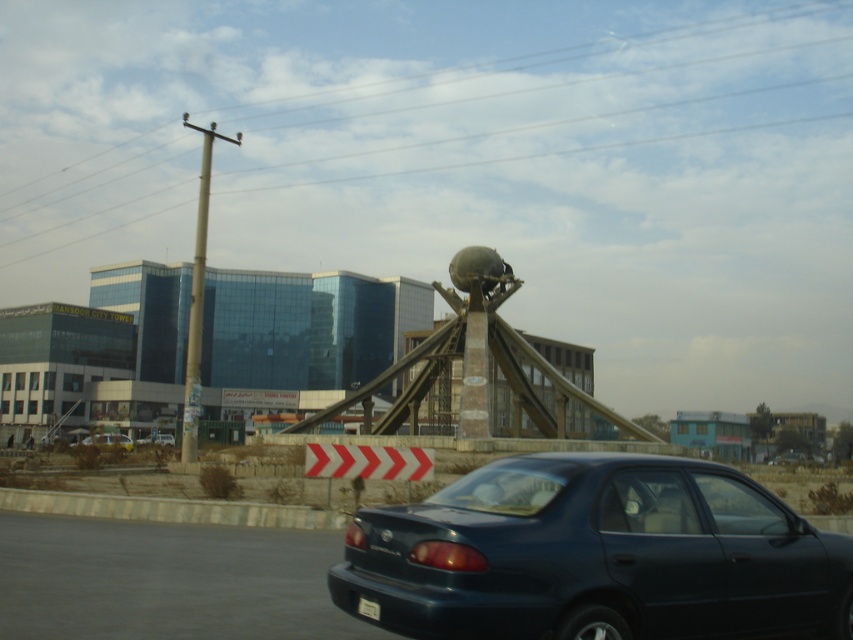
Question: Which of the following is the closest to the observer?

Choices:
 (A) (454, 310)
 (B) (91, 440)
 (C) (482, 547)
 (D) (349, 76)

Answer: (C)

Question: Does metallic pole at upper center have a lesser width compared to matte black car at lower right?

Choices:
 (A) yes
 (B) no

Answer: (B)

Question: Is matte black car at lower right thinner than metallic blue sedan at center?

Choices:
 (A) yes
 (B) no

Answer: (B)

Question: Which point appears closest to the camera in this image?

Choices:
 (A) (457, 589)
 (B) (724, 252)
 (C) (447, 342)
 (D) (96, 435)

Answer: (A)

Question: Is metallic pole at upper center wider than stone globe at center?

Choices:
 (A) yes
 (B) no

Answer: (A)

Question: Which of the following is the farthest from the observer?

Choices:
 (A) stone globe at center
 (B) metallic pole at upper center

Answer: (B)